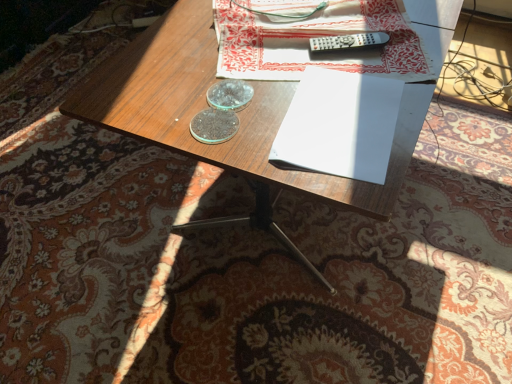
Where is `vacant area on the back side of black plastic remote at upper center`? Image resolution: width=512 pixels, height=384 pixels. vacant area on the back side of black plastic remote at upper center is located at coordinates (348, 21).